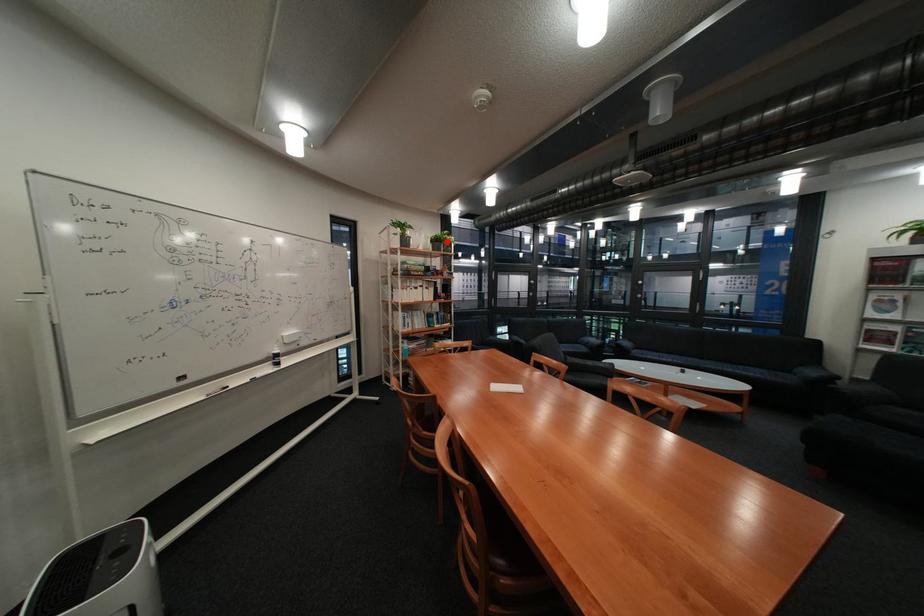
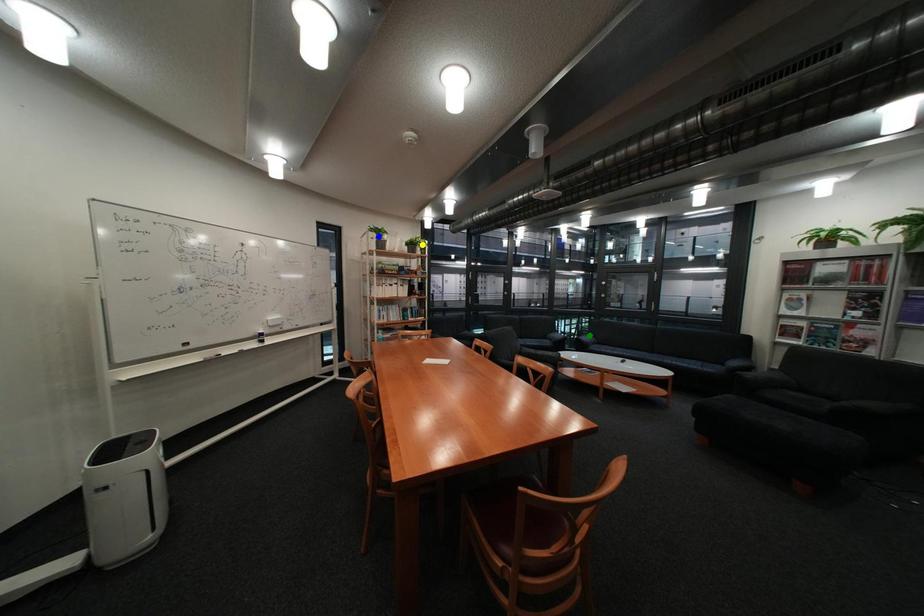
Question: I am providing you with two images of the same scene from different viewpoints. A red point is marked on the first image. You are given multiple points on the second image. Which mark in image 2 goes with the point in image 1?

Choices:
 (A) yellow point
 (B) green point
 (C) blue point

Answer: (A)